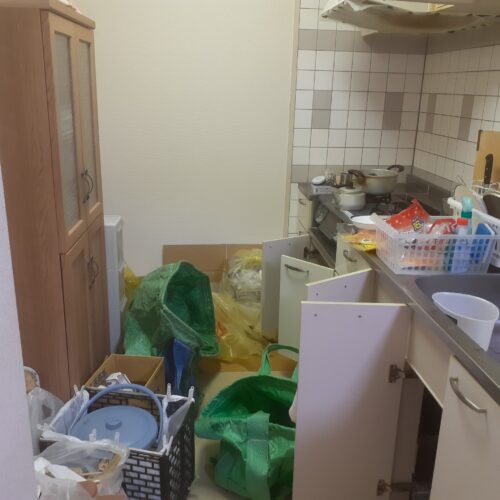
In order to click on tile in this screenshot , I will do `click(371, 111)`, `click(432, 141)`.